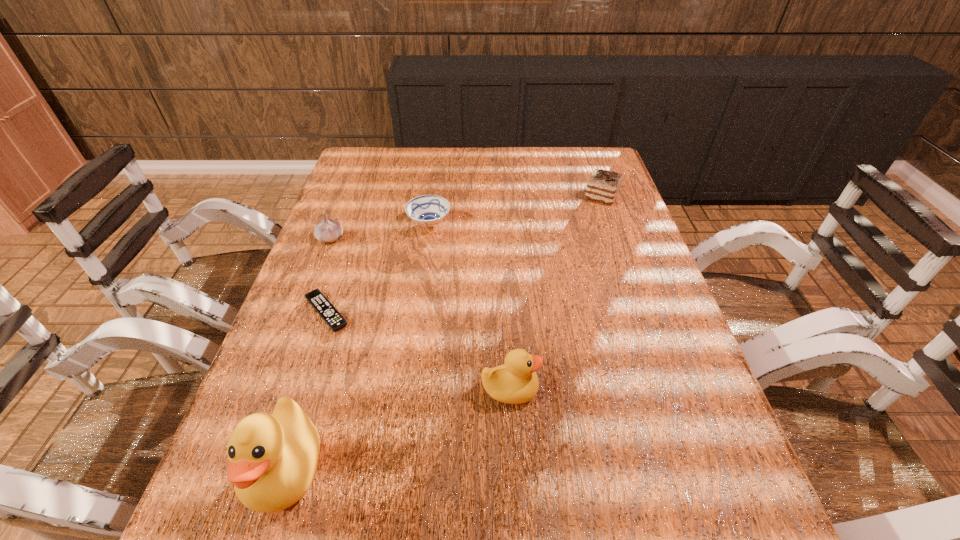
Find the location of a particular element. This screenshot has height=540, width=960. the taller duck is located at coordinates (272, 459).

Where is `the tallest object`? The image size is (960, 540). the tallest object is located at coordinates (272, 459).

Image resolution: width=960 pixels, height=540 pixels. I want to click on the fifth shortest object, so click(515, 382).

Locate an element on the screen. the farther duck is located at coordinates (515, 382).

You are a GUI agent. You are given a task and a screenshot of the screen. Output one action in this format:
    pyautogui.click(x=<x>, y=<y>)
    Task: Click on the chocolate cake
    
    Given the screenshot: What is the action you would take?
    pyautogui.click(x=603, y=186)

Where is `the farthest object`? the farthest object is located at coordinates (603, 186).

Locate an element on the screen. The height and width of the screenshot is (540, 960). soup bowl is located at coordinates (427, 210).

Locate an element on the screen. the third object from right to left is located at coordinates (427, 210).

Locate an element on the screen. remote control is located at coordinates (316, 298).

Where is `the shortest object`? This screenshot has width=960, height=540. the shortest object is located at coordinates (316, 298).